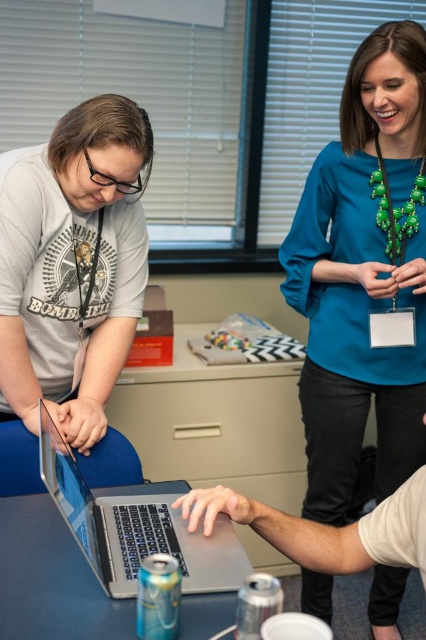
Can you confirm if silver metallic table at center is positioned to the left of satin silver laptop at center?

Correct, you'll find silver metallic table at center to the left of satin silver laptop at center.

Which is behind, point (206, 636) or point (207, 584)?

Positioned behind is point (207, 584).

The width and height of the screenshot is (426, 640). I want to click on silver metallic table at center, so click(51, 579).

Can you confirm if matte gray laptop at center is taller than silver metallic table at center?

Yes.

Looking at this image, can you confirm if matte gray laptop at center is positioned to the right of silver metallic table at center?

Incorrect, matte gray laptop at center is not on the right side of silver metallic table at center.

The image size is (426, 640). What are the coordinates of `matte gray laptop at center` in the screenshot? It's located at (72, 264).

Is teal fabric blouse at upper right above matte gray laptop at center?

No, teal fabric blouse at upper right is not above matte gray laptop at center.

You are a GUI agent. You are given a task and a screenshot of the screen. Output one action in this format:
    pyautogui.click(x=<x>, y=<y>)
    Task: Click on the teal fabric blouse at upper right
    This screenshot has height=640, width=426.
    Given the screenshot: What is the action you would take?
    pyautogui.click(x=363, y=275)